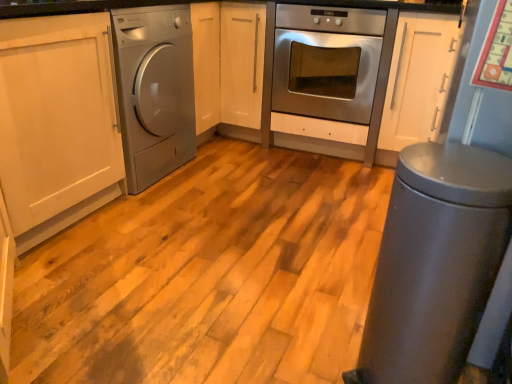
Question: From a real-world perspective, is metallic gray trash can at lower right positioned above or below stainless steel oven at center?

Choices:
 (A) below
 (B) above

Answer: (A)

Question: Looking at the image, does metallic gray trash can at lower right seem bigger or smaller compared to stainless steel oven at center?

Choices:
 (A) big
 (B) small

Answer: (B)

Question: Estimate the real-world distances between objects in this image. Which object is farther from the metallic gray trash can at lower right?

Choices:
 (A) stainless steel oven at center
 (B) white matte cabinet at center
 (C) satin silver washing machine at left

Answer: (B)

Question: Considering the real-world distances, which object is closest to the white matte cabinet at center?

Choices:
 (A) metallic gray trash can at lower right
 (B) satin silver washing machine at left
 (C) stainless steel oven at center

Answer: (C)